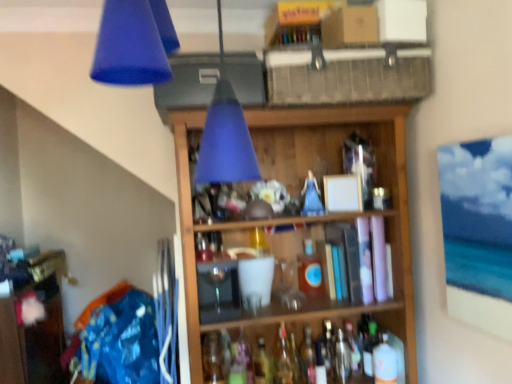
Question: Is translucent plastic bottle at lower right, the sixth bottle viewed from the left, taller or shorter than translucent glass bottle at center, the third bottle viewed from the right?

Choices:
 (A) short
 (B) tall

Answer: (A)

Question: From a real-world perspective, relative to translucent glass bottle at center, the third bottle viewed from the right, is translucent plastic bottle at lower right, the 1th bottle in the right-to-left sequence, vertically above or below?

Choices:
 (A) above
 (B) below

Answer: (B)

Question: Which object is the closest to the translucent glass bottle at center, the second bottle when ordered from left to right?

Choices:
 (A) translucent glass wine bottle at center, which appears as the 4th wine bottle when viewed from the right
 (B) wooden shelf at center
 (C) translucent glass bottle at center, the third bottle viewed from the right
 (D) translucent glass wine bottle at center, the 3th wine bottle viewed from the left
 (E) translucent plastic bottle at center-right, acting as the fifth bottle starting from the left

Answer: (A)

Question: Estimate the real-world distances between objects in this image. Which object is closer to the translucent glass wine bottle at center, marked as the third wine bottle in a right-to-left arrangement?

Choices:
 (A) translucent glass wine bottle at center, the 1th wine bottle viewed from the left
 (B) matte blue cone at upper center
 (C) translucent glass bottle at center, the second bottle when ordered from left to right
 (D) translucent glass bottle at center, placed as the 6th bottle when sorted from right to left
 (E) wooden shelf at center

Answer: (C)